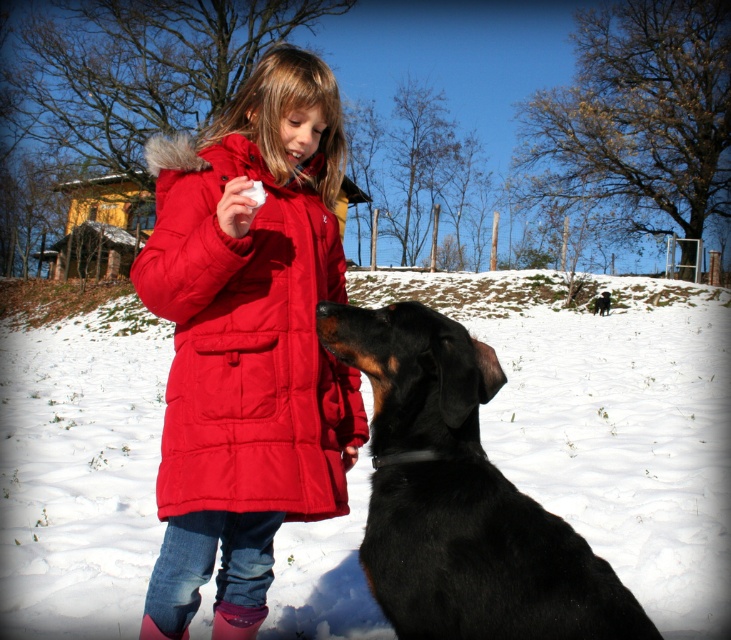
Who is taller, matte red coat at center or black smooth fur dog at lower right?

matte red coat at center is taller.

Locate an element on the screen. This screenshot has height=640, width=731. matte red coat at center is located at coordinates (246, 340).

I want to click on matte red coat at center, so click(x=246, y=340).

Does white fluffy snow at center appear under matte red coat at center?

Actually, white fluffy snow at center is above matte red coat at center.

Is white fluffy snow at center above matte red coat at center?

Yes, white fluffy snow at center is above matte red coat at center.

Describe the element at coordinates (607, 420) in the screenshot. Image resolution: width=731 pixels, height=640 pixels. I see `white fluffy snow at center` at that location.

Where is `white fluffy snow at center`? The image size is (731, 640). white fluffy snow at center is located at coordinates (607, 420).

The width and height of the screenshot is (731, 640). What do you see at coordinates (607, 420) in the screenshot?
I see `white fluffy snow at center` at bounding box center [607, 420].

Is point (86, 630) positioned behind point (425, 388)?

Yes.

Is point (696, 600) closer to camera compared to point (594, 586)?

No.

Image resolution: width=731 pixels, height=640 pixels. Identify the location of white fluffy snow at center. (607, 420).